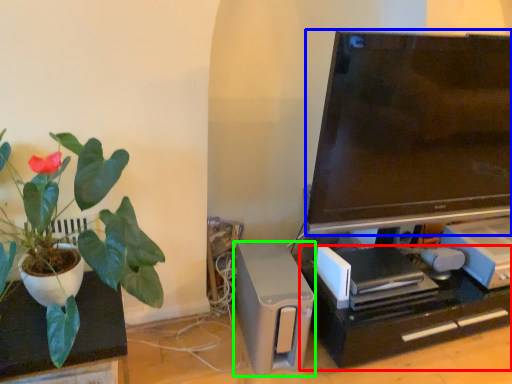
Question: Which object is the farthest from computer desk (highlighted by a red box)? Choose among these: television (highlighted by a blue box) or appliance (highlighted by a green box).

Choices:
 (A) television
 (B) appliance

Answer: (A)